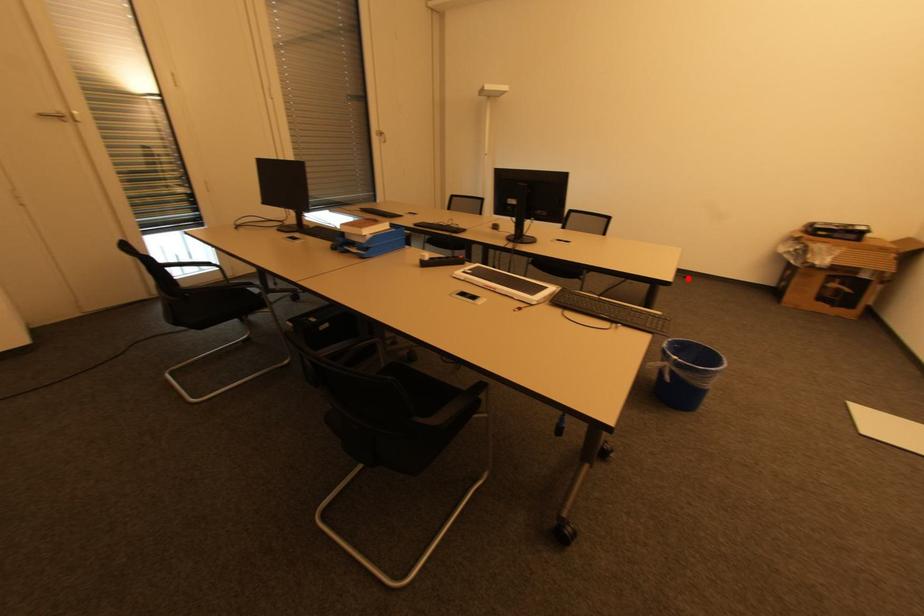
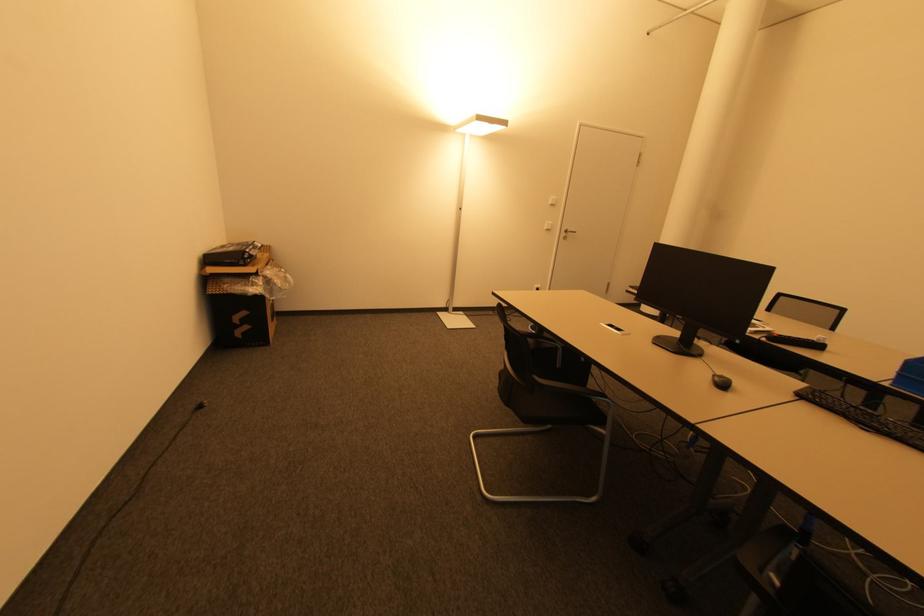
Question: I am providing you with two images of the same scene from different viewpoints. A red point is marked on the first image. Is the red point's position out of view in image 2?

Choices:
 (A) Yes
 (B) No

Answer: (B)